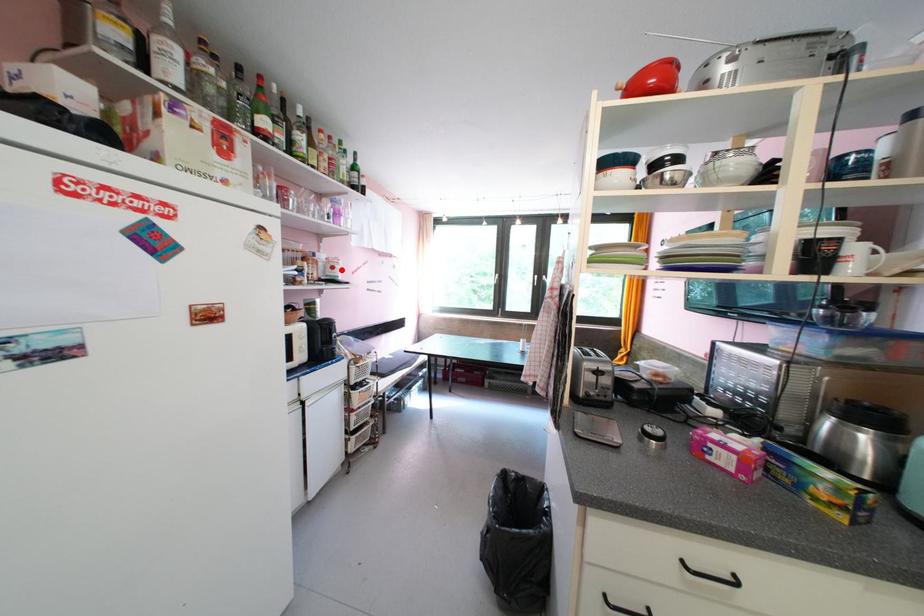
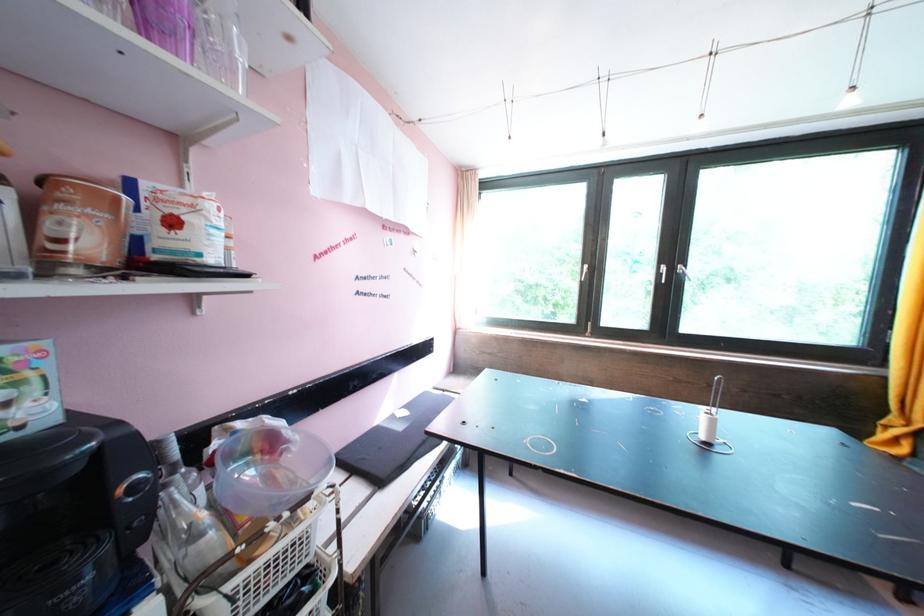
Find the pixel in the second image that matches the highlighted location in the first image.

(181, 225)